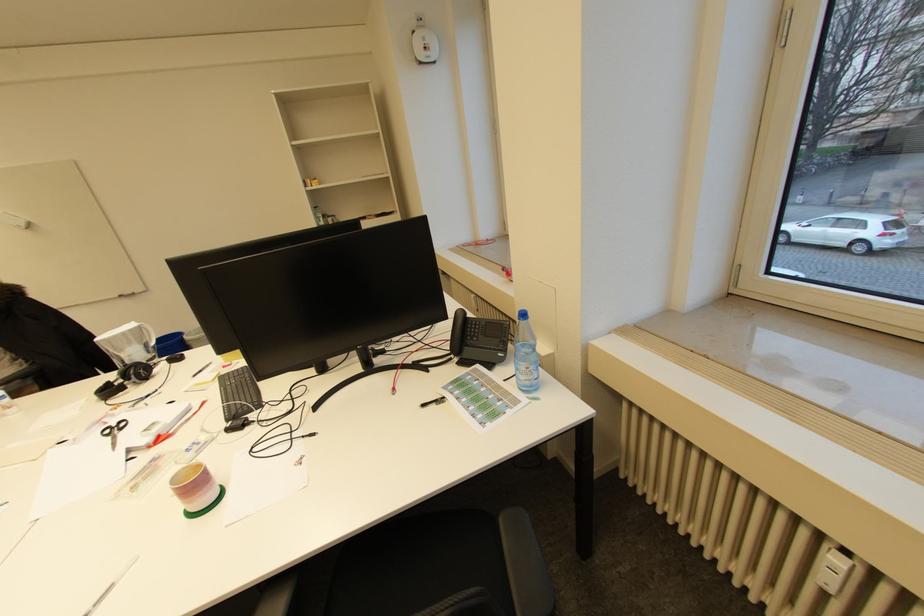
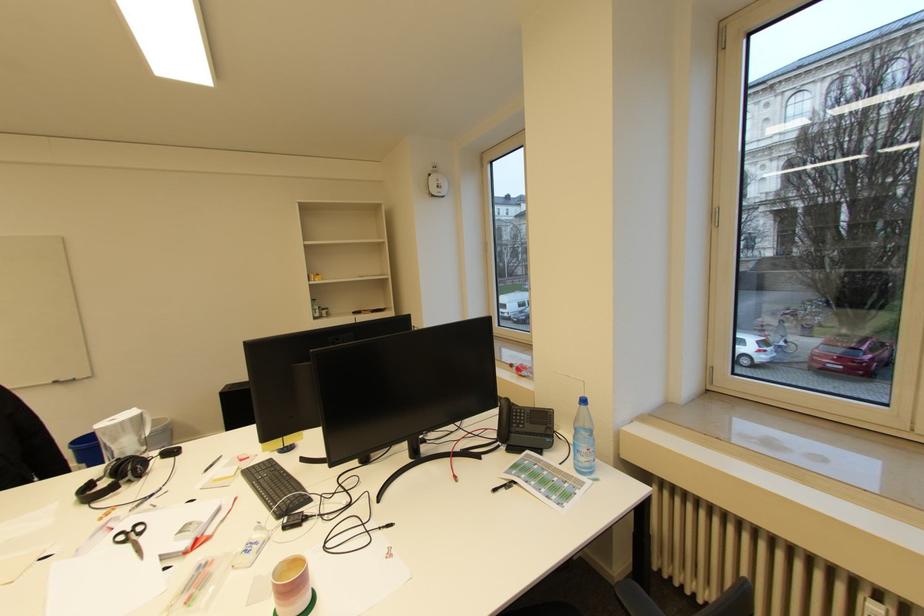
In the second image, find the point that corresponds to the point at 116,402 in the first image.

(100, 506)